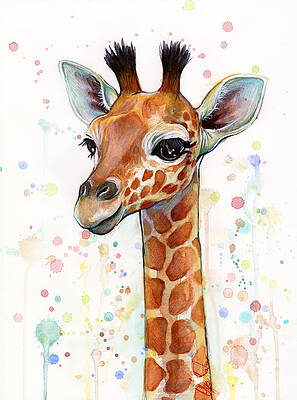
Where is `painting`? The width and height of the screenshot is (297, 400). painting is located at coordinates (253, 344).